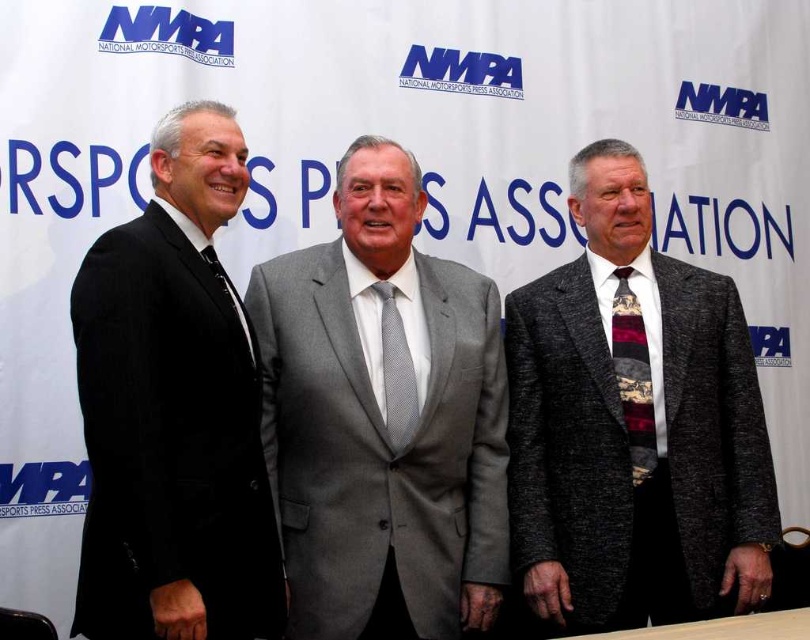
Question: Which is farther from the gray textured tie at center?

Choices:
 (A) gray wool suit at center
 (B) gray textured suit at center
 (C) multicolored woven tie at right
 (D) black suit at left

Answer: (C)

Question: Which point is closer to the camera?

Choices:
 (A) (632, 294)
 (B) (314, 321)
 (C) (195, 168)
 (D) (736, 353)

Answer: (C)

Question: Can you confirm if gray wool suit at center is smaller than black suit at left?

Choices:
 (A) yes
 (B) no

Answer: (B)

Question: Among these points, which one is nearest to the camera?

Choices:
 (A) (390, 324)
 (B) (714, 472)
 (C) (612, 348)
 (D) (130, 429)

Answer: (D)

Question: Observing the image, what is the correct spatial positioning of multicolored woven tie at right in reference to gray textured tie at center?

Choices:
 (A) below
 (B) above

Answer: (A)

Question: Is gray wool suit at center thinner than matte black tie at left?

Choices:
 (A) no
 (B) yes

Answer: (A)